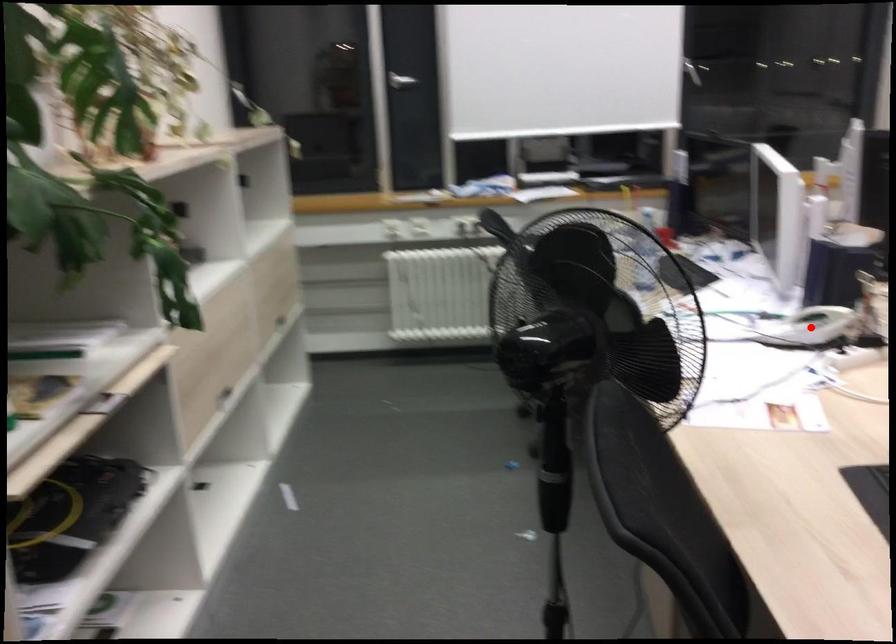
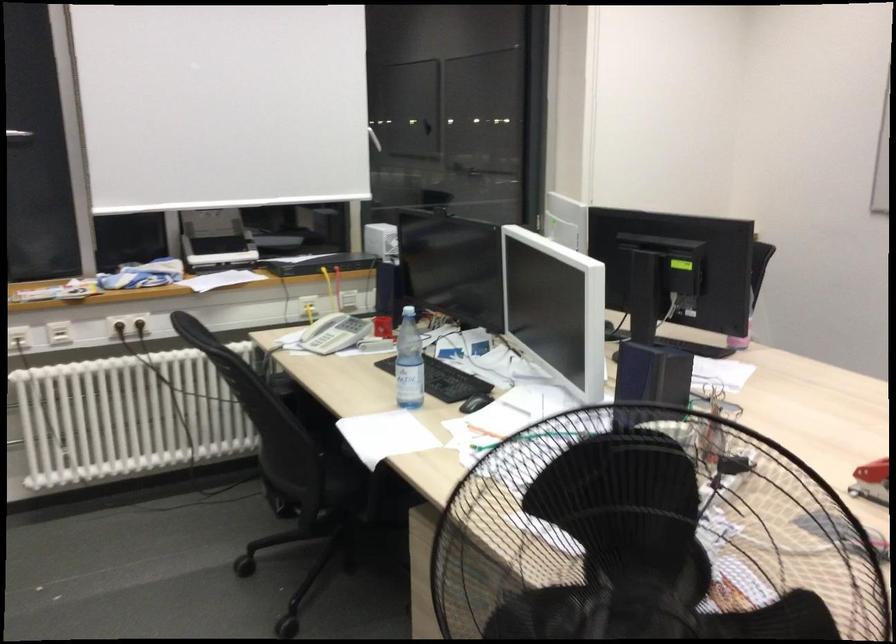
Question: I am providing you with two images of the same scene from different viewpoints. A red point is marked on the first image. Is the red point's position out of view in image 2?

Choices:
 (A) Yes
 (B) No

Answer: (A)